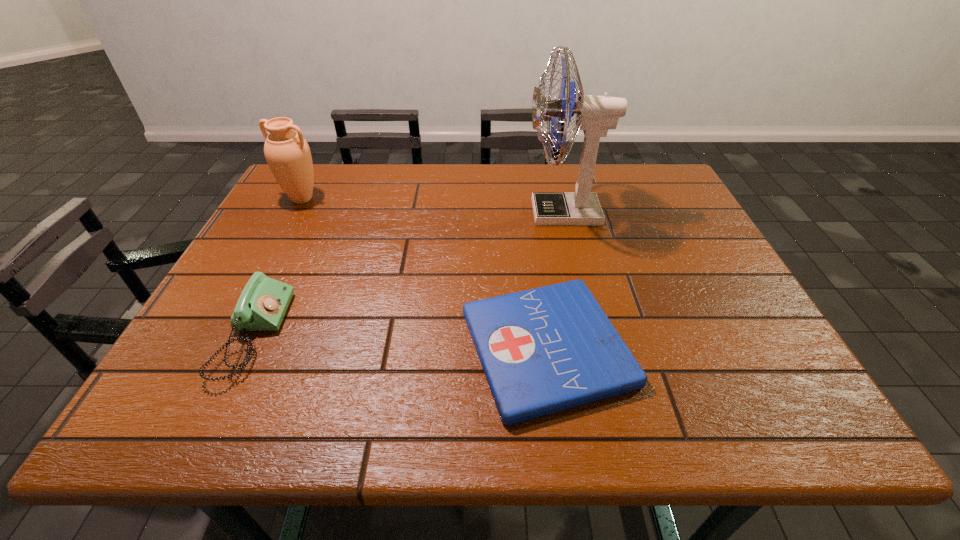
This screenshot has height=540, width=960. Identify the location of the tallest object. (595, 115).

Locate an element on the screen. This screenshot has height=540, width=960. urn is located at coordinates (287, 153).

Identify the location of the third tallest object. Image resolution: width=960 pixels, height=540 pixels. 262,305.

Locate an element on the screen. This screenshot has width=960, height=540. the shortest object is located at coordinates (547, 349).

Where is `vacant space located on the front-facing side of the tallest object`? This screenshot has height=540, width=960. vacant space located on the front-facing side of the tallest object is located at coordinates (452, 213).

Locate an element on the screen. vacant space positioned on the front-facing side of the tallest object is located at coordinates (508, 213).

Image resolution: width=960 pixels, height=540 pixels. In order to click on vacant position located 0.160m on the front-facing side of the tallest object in this screenshot , I will do `click(468, 213)`.

Locate an element on the screen. This screenshot has height=540, width=960. vacant position located on the right of the second tallest object is located at coordinates (345, 199).

Where is `vacant space located 0.080m on the dial of the second shortest object`? Image resolution: width=960 pixels, height=540 pixels. vacant space located 0.080m on the dial of the second shortest object is located at coordinates (319, 334).

You are a GUI agent. You are given a task and a screenshot of the screen. Output one action in this format:
    pyautogui.click(x=<x>, y=<y>)
    Task: Click on the free location located 0.370m on the left of the first-aid kit
    The image size is (960, 540).
    Given the screenshot: What is the action you would take?
    pyautogui.click(x=274, y=348)